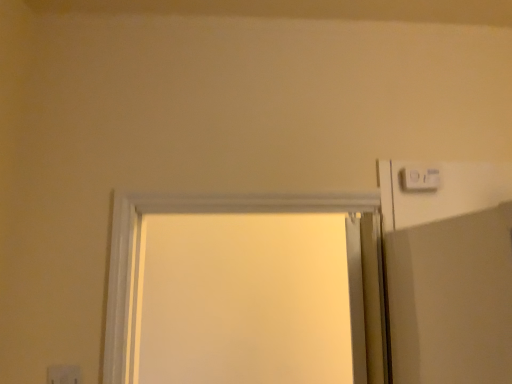
Question: Is white plastic electric outlet at lower left completely or partially outside of white plastic light switch at upper right?

Choices:
 (A) no
 (B) yes

Answer: (B)

Question: Can you confirm if white plastic electric outlet at lower left is taller than white plastic light switch at upper right?

Choices:
 (A) yes
 (B) no

Answer: (A)

Question: Is the depth of white plastic electric outlet at lower left greater than that of white plastic light switch at upper right?

Choices:
 (A) no
 (B) yes

Answer: (A)

Question: Is white plastic electric outlet at lower left next to white plastic light switch at upper right?

Choices:
 (A) yes
 (B) no

Answer: (B)

Question: Is white plastic electric outlet at lower left bigger than white plastic light switch at upper right?

Choices:
 (A) no
 (B) yes

Answer: (A)

Question: Is white plastic electric outlet at lower left not near white plastic light switch at upper right?

Choices:
 (A) yes
 (B) no

Answer: (A)

Question: Does white plastic light switch at upper right have a greater width compared to white plastic electric outlet at lower left?

Choices:
 (A) no
 (B) yes

Answer: (B)

Question: Is white plastic light switch at upper right closer to camera compared to white plastic electric outlet at lower left?

Choices:
 (A) yes
 (B) no

Answer: (B)

Question: Is white plastic electric outlet at lower left surrounded by white plastic light switch at upper right?

Choices:
 (A) yes
 (B) no

Answer: (B)

Question: From the image's perspective, is white plastic light switch at upper right over white plastic electric outlet at lower left?

Choices:
 (A) no
 (B) yes

Answer: (B)

Question: Are white plastic light switch at upper right and white plastic electric outlet at lower left located far from each other?

Choices:
 (A) no
 (B) yes

Answer: (B)

Question: Can you confirm if white plastic light switch at upper right is smaller than white plastic electric outlet at lower left?

Choices:
 (A) no
 (B) yes

Answer: (A)

Question: Relative to white plastic light switch at upper right, is white plastic electric outlet at lower left in front or behind?

Choices:
 (A) front
 (B) behind

Answer: (A)